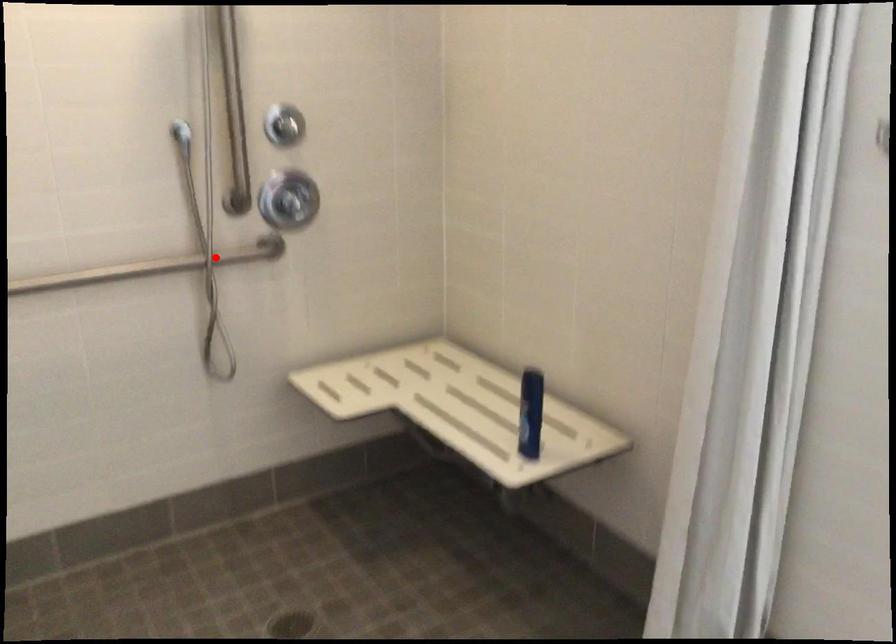
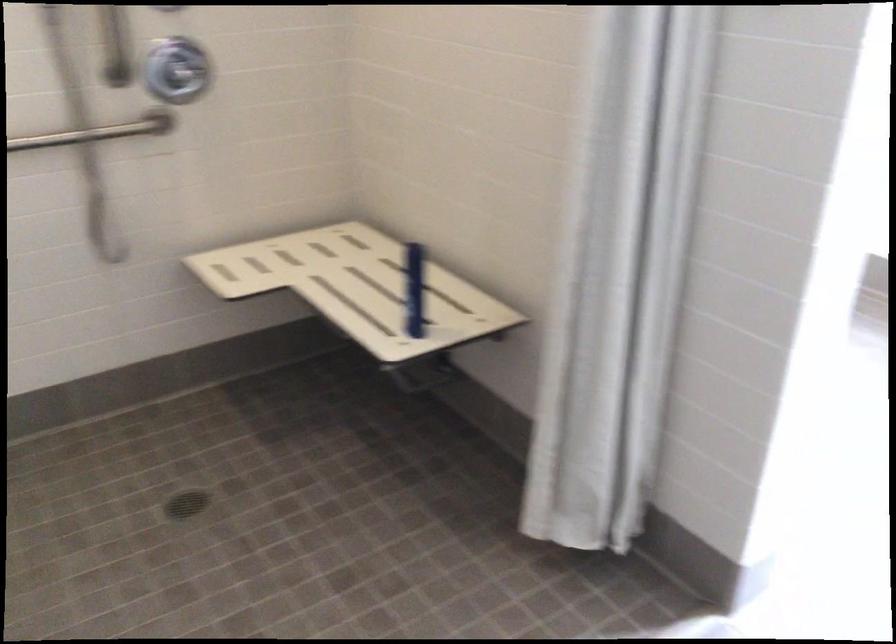
In the second image, find the point that corresponds to the highlighted location in the first image.

(98, 131)